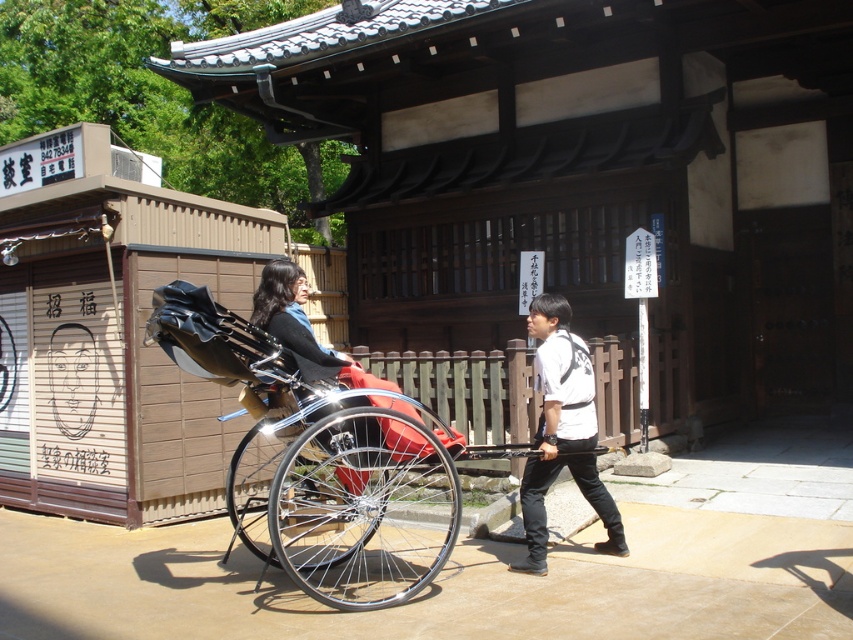
You are a photographer standing in the historical district where the rickshaw scene is taking place. You want to capture a photo of the shiny chrome rickshaw at center and the white matte shirt at center. Which object should you focus on first if you want to ensure both are in sharp focus?

The shiny chrome rickshaw at center is located below the white matte shirt at center. To ensure both are in sharp focus, you should focus on the white matte shirt at center first since it is farther away from the camera, allowing the rickshaw to fall within the depth of field.

You are a photographer trying to capture a wide shot of the shiny chrome rickshaw at center and the white matte shirt at center in the same frame. Given that your camera can only focus on objects within a 1.5 meter width, will both objects fit in the frame?

The shiny chrome rickshaw at center is wider than the white matte shirt at center. Since the camera can focus on objects within a 1.5 meter width, both objects can fit as long as their combined width does not exceed 1.5 meters. However, the exact fit depends on their individual widths, but since the rickshaw is wider, it might take up more space. Without specific measurements, it is uncertain if both will fit perfectly.

You are a tourist standing in front of the white matte shirt at center and the matte black rickshaw at center. Which object is closer to you?

The white matte shirt at center is closer to you because it is further to the viewer than the matte black rickshaw at center, meaning it appears nearer in perspective.